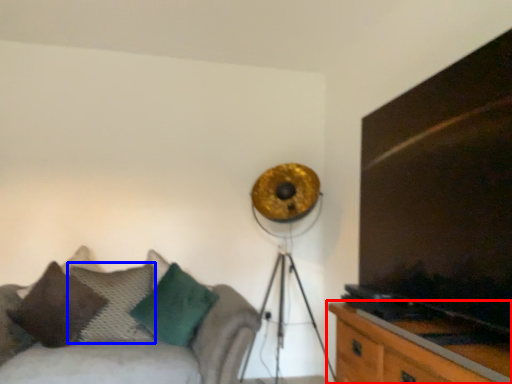
Question: Which point is closer to the camera, table (highlighted by a red box) or pillow (highlighted by a blue box)?

Choices:
 (A) table
 (B) pillow

Answer: (A)